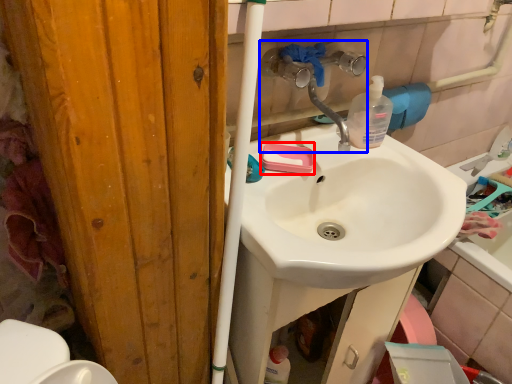
Question: Which object appears closest to the camera in this image, soap (highlighted by a red box) or plumbing fixture (highlighted by a blue box)?

Choices:
 (A) soap
 (B) plumbing fixture

Answer: (B)